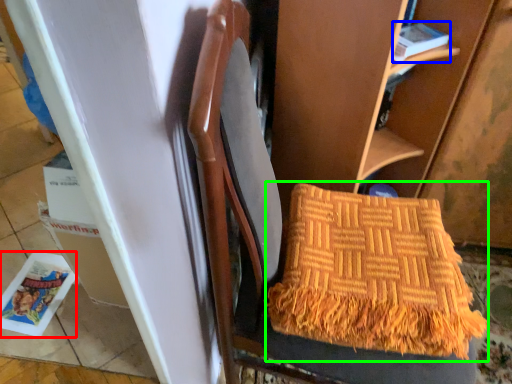
Question: Which object is the farthest from magazine (highlighted by a red box)? Choose among these: magazine (highlighted by a blue box) or blanket (highlighted by a green box).

Choices:
 (A) magazine
 (B) blanket

Answer: (A)